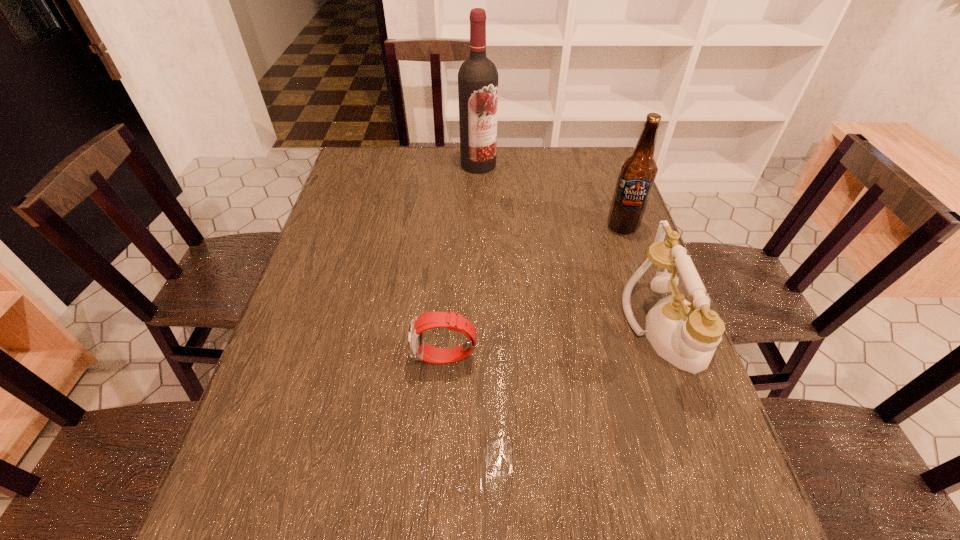
I want to click on vacant area situated on the label of the third shortest object, so click(x=593, y=335).

Image resolution: width=960 pixels, height=540 pixels. I want to click on vacant area situated on the label of the third shortest object, so click(x=601, y=305).

Find the location of a particular element. The height and width of the screenshot is (540, 960). free location located on the label of the tallest object is located at coordinates (502, 221).

The width and height of the screenshot is (960, 540). What are the coordinates of `vacant space located on the label of the tallest object` in the screenshot? It's located at (492, 198).

Find the location of a particular element. This screenshot has width=960, height=540. free spot located on the label of the tallest object is located at coordinates tap(502, 219).

The width and height of the screenshot is (960, 540). I want to click on object located at the far edge, so click(478, 79).

Where is `telephone at the right edge`? The image size is (960, 540). telephone at the right edge is located at coordinates (686, 335).

Where is `beer bottle present at the right edge`? beer bottle present at the right edge is located at coordinates (637, 174).

Locate an element on the screen. The height and width of the screenshot is (540, 960). free space at the far edge of the desktop is located at coordinates (552, 174).

In the image, there is a desktop. At what (x,y) coordinates should I click in order to perform the action: click on free space at the near edge. Please return your answer as a coordinate pair (x, y). Looking at the image, I should click on (537, 457).